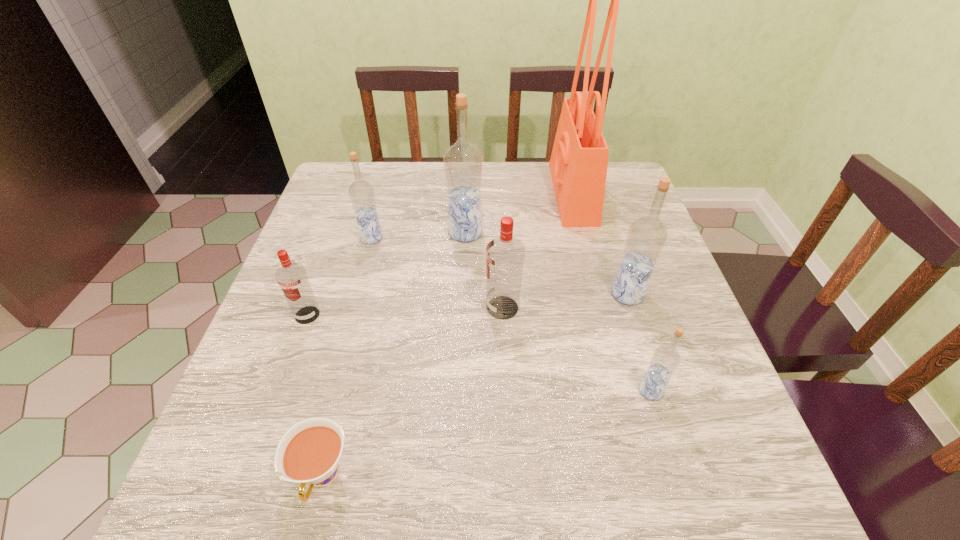
The width and height of the screenshot is (960, 540). I want to click on object located in the near left corner section of the desktop, so click(309, 452).

Where is `object present at the far right corner`? The image size is (960, 540). object present at the far right corner is located at coordinates (579, 160).

Where is `free space at the far edge`? free space at the far edge is located at coordinates (503, 181).

Find the location of `blank space at the near edge of the desktop`. blank space at the near edge of the desktop is located at coordinates (613, 490).

Where is `vacant area at the left edge of the desktop`? The height and width of the screenshot is (540, 960). vacant area at the left edge of the desktop is located at coordinates (356, 268).

Find the location of `vacant space at the right edge`. vacant space at the right edge is located at coordinates (701, 346).

The width and height of the screenshot is (960, 540). I want to click on vacant space at the far right corner, so click(612, 185).

Where is `free space at the near right corner`? This screenshot has height=540, width=960. free space at the near right corner is located at coordinates (690, 467).

The image size is (960, 540). Find the location of `free point between the third blue vodka from right to left and the white teacup`. free point between the third blue vodka from right to left and the white teacup is located at coordinates (394, 354).

I want to click on free space between the left red vodka and the leftmost blue vodka, so click(x=339, y=276).